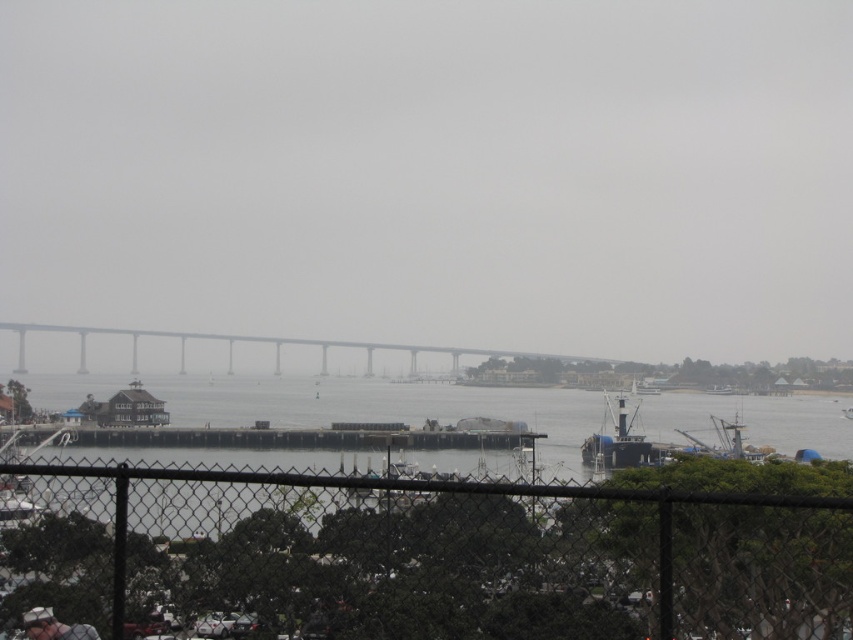
Question: Is clear water at lower center in front of white plastic boat at center?

Choices:
 (A) no
 (B) yes

Answer: (B)

Question: Can you confirm if black chain-link fence at lower center is wider than white plastic boat at center?

Choices:
 (A) yes
 (B) no

Answer: (B)

Question: Does gray concrete bridge at center have a greater width compared to white matte hat at lower left?

Choices:
 (A) no
 (B) yes

Answer: (B)

Question: Which point is farther from the camera taking this photo?

Choices:
 (A) (672, 417)
 (B) (641, 461)

Answer: (A)

Question: Which of the following is the farthest from the observer?

Choices:
 (A) white plastic boat at center
 (B) clear water at lower center
 (C) gray concrete bridge at center
 (D) black chain-link fence at lower center

Answer: (C)

Question: Estimate the real-world distances between objects in this image. Which object is farther from the gray concrete bridge at center?

Choices:
 (A) white matte hat at lower left
 (B) black chain-link fence at lower center
 (C) white plastic boat at center

Answer: (B)